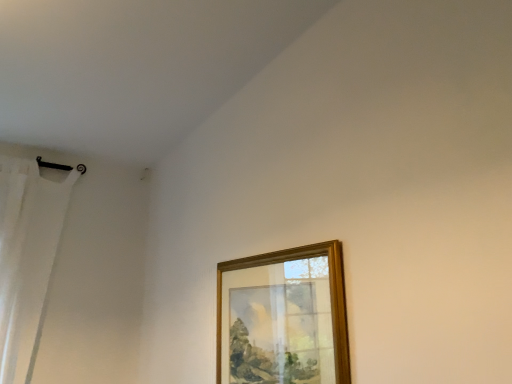
At what (x,y) coordinates should I click in order to perform the action: click on white sheer curtain at left. Please return your answer as a coordinate pair (x, y). Looking at the image, I should click on (27, 258).

Measure the distance between point (x=10, y=279) and camera.

A distance of 6.64 feet exists between point (x=10, y=279) and camera.

The image size is (512, 384). What do you see at coordinates (27, 258) in the screenshot? I see `white sheer curtain at left` at bounding box center [27, 258].

Describe the element at coordinates (283, 317) in the screenshot. This screenshot has height=384, width=512. I see `wooden picture frame at upper center` at that location.

The width and height of the screenshot is (512, 384). I want to click on wooden picture frame at upper center, so click(283, 317).

The image size is (512, 384). Find the location of `white sheer curtain at left`. white sheer curtain at left is located at coordinates (27, 258).

In the scene shown: Which object is positioned more to the left, white sheer curtain at left or wooden picture frame at upper center?

white sheer curtain at left is more to the left.

Is white sheer curtain at left closer to camera compared to wooden picture frame at upper center?

No, white sheer curtain at left is behind wooden picture frame at upper center.

Considering the positions of point (50, 274) and point (305, 260), is point (50, 274) closer or farther from the camera than point (305, 260)?

Point (50, 274) appears to be farther away from the viewer than point (305, 260).

From the image's perspective, is white sheer curtain at left located above wooden picture frame at upper center?

Indeed, from the image's perspective, white sheer curtain at left is shown above wooden picture frame at upper center.

In the scene shown: From a real-world perspective, who is located higher, white sheer curtain at left or wooden picture frame at upper center?

white sheer curtain at left.

Does white sheer curtain at left have a lesser width compared to wooden picture frame at upper center?

No, white sheer curtain at left is not thinner than wooden picture frame at upper center.

Can you confirm if white sheer curtain at left is taller than wooden picture frame at upper center?

Yes, white sheer curtain at left is taller than wooden picture frame at upper center.

Considering the sizes of white sheer curtain at left and wooden picture frame at upper center in the image, is white sheer curtain at left bigger or smaller than wooden picture frame at upper center?

white sheer curtain at left is bigger than wooden picture frame at upper center.

Is white sheer curtain at left positioned beyond the bounds of wooden picture frame at upper center?

Indeed, white sheer curtain at left is completely outside wooden picture frame at upper center.

Would you consider white sheer curtain at left to be distant from wooden picture frame at upper center?

Absolutely, white sheer curtain at left is distant from wooden picture frame at upper center.

Is white sheer curtain at left positioned with its back to wooden picture frame at upper center?

white sheer curtain at left is not turned away from wooden picture frame at upper center.

How different are the orientations of white sheer curtain at left and wooden picture frame at upper center in degrees?

The facing directions of white sheer curtain at left and wooden picture frame at upper center are 91.9 degrees apart.

At what (x,y) coordinates should I click in order to perform the action: click on curtain on the left side of wooden picture frame at upper center. Please return your answer as a coordinate pair (x, y). Looking at the image, I should click on (27, 258).

Which object is positioned more to the left, wooden picture frame at upper center or white sheer curtain at left?

From the viewer's perspective, white sheer curtain at left appears more on the left side.

Between wooden picture frame at upper center and white sheer curtain at left, which one is positioned behind?

white sheer curtain at left is behind.

Does point (343, 315) appear closer or farther from the camera than point (13, 363)?

Point (343, 315).

From the image's perspective, does wooden picture frame at upper center appear lower than white sheer curtain at left?

Yes, from the image's perspective, wooden picture frame at upper center is below white sheer curtain at left.

From a real-world perspective, is wooden picture frame at upper center on white sheer curtain at left?

No, from a real-world perspective, wooden picture frame at upper center is not above white sheer curtain at left.

Does wooden picture frame at upper center have a greater width compared to white sheer curtain at left?

No.

Is wooden picture frame at upper center taller or shorter than white sheer curtain at left?

Clearly, wooden picture frame at upper center is shorter compared to white sheer curtain at left.

Between wooden picture frame at upper center and white sheer curtain at left, which one has larger size?

white sheer curtain at left.

Does wooden picture frame at upper center contain white sheer curtain at left?

That's incorrect, white sheer curtain at left is not inside wooden picture frame at upper center.

Would you say wooden picture frame at upper center is a long distance from white sheer curtain at left?

Indeed, wooden picture frame at upper center is not near white sheer curtain at left.

Could you tell me if wooden picture frame at upper center is facing white sheer curtain at left?

No, wooden picture frame at upper center is not oriented towards white sheer curtain at left.

Can you tell me how much wooden picture frame at upper center and white sheer curtain at left differ in facing direction?

91.9 degrees separate the facing orientations of wooden picture frame at upper center and white sheer curtain at left.

Find the location of `curtain located on the left of wooden picture frame at upper center`. curtain located on the left of wooden picture frame at upper center is located at coordinates (27, 258).

Locate an element on the screen. The height and width of the screenshot is (384, 512). picture frame in front of the white sheer curtain at left is located at coordinates (283, 317).

At what (x,y) coordinates should I click in order to perform the action: click on picture frame below the white sheer curtain at left (from the image's perspective). Please return your answer as a coordinate pair (x, y). Image resolution: width=512 pixels, height=384 pixels. Looking at the image, I should click on (283, 317).